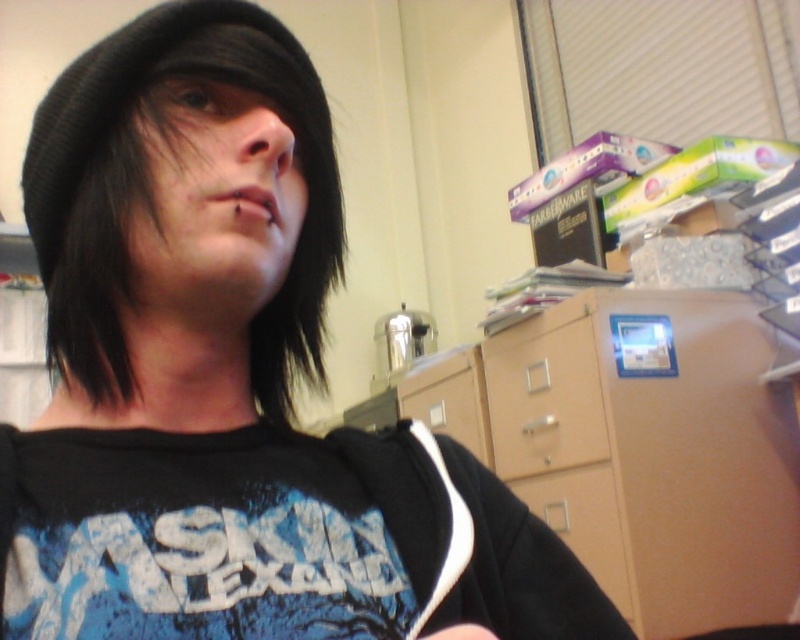
Question: Which point is closer to the camera?

Choices:
 (A) (334, 200)
 (B) (637, 388)

Answer: (A)

Question: Considering the relative positions of black knit hat at upper left and black matte hand at lower left in the image provided, where is black knit hat at upper left located with respect to black matte hand at lower left?

Choices:
 (A) below
 (B) above

Answer: (B)

Question: Which of the following is the farthest from the observer?

Choices:
 (A) black matte hand at lower left
 (B) beige/file cabinet at lower right
 (C) black knit hat at upper left

Answer: (B)

Question: Is black knit hat at upper left positioned in front of black matte hand at lower left?

Choices:
 (A) no
 (B) yes

Answer: (A)

Question: Based on their relative distances, which object is nearer to the black knit hat at upper left?

Choices:
 (A) black matte hand at lower left
 (B) beige/file cabinet at lower right

Answer: (A)

Question: Is beige/file cabinet at lower right to the right of black knit hat at upper left from the viewer's perspective?

Choices:
 (A) yes
 (B) no

Answer: (A)